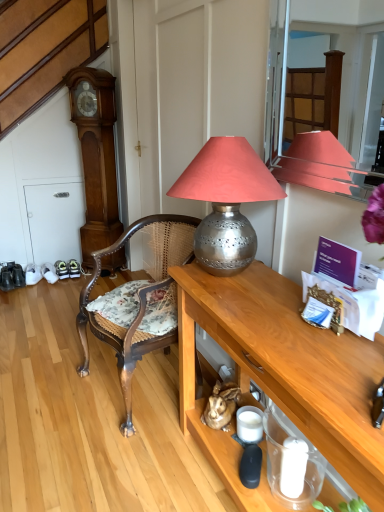
Question: Is wooden table at center closer to camera compared to wooden grandfather clock at left?

Choices:
 (A) no
 (B) yes

Answer: (B)

Question: Is wooden table at center at the right side of wooden grandfather clock at left?

Choices:
 (A) yes
 (B) no

Answer: (A)

Question: Is wooden table at center shorter than wooden grandfather clock at left?

Choices:
 (A) yes
 (B) no

Answer: (A)

Question: Is wooden table at center smaller than wooden grandfather clock at left?

Choices:
 (A) no
 (B) yes

Answer: (A)

Question: Considering the relative sizes of wooden table at center and wooden grandfather clock at left in the image provided, is wooden table at center wider than wooden grandfather clock at left?

Choices:
 (A) yes
 (B) no

Answer: (A)

Question: Looking at the image, does wooden grandfather clock at left seem bigger or smaller compared to silver metallic lampshade at center?

Choices:
 (A) big
 (B) small

Answer: (A)

Question: Does point [x=104, y=189] appear closer or farther from the camera than point [x=208, y=200]?

Choices:
 (A) closer
 (B) farther

Answer: (B)

Question: Considering the relative positions of wooden grandfather clock at left and silver metallic lampshade at center in the image provided, is wooden grandfather clock at left to the left or to the right of silver metallic lampshade at center?

Choices:
 (A) right
 (B) left

Answer: (B)

Question: Considering the positions of wooden grandfather clock at left and silver metallic lampshade at center in the image, is wooden grandfather clock at left taller or shorter than silver metallic lampshade at center?

Choices:
 (A) short
 (B) tall

Answer: (B)

Question: Considering their positions, is woven cane chair at center located in front of or behind wooden grandfather clock at left?

Choices:
 (A) behind
 (B) front

Answer: (B)

Question: Looking at the image, does woven cane chair at center seem bigger or smaller compared to wooden grandfather clock at left?

Choices:
 (A) small
 (B) big

Answer: (B)

Question: Considering the positions of woven cane chair at center and wooden grandfather clock at left in the image, is woven cane chair at center wider or thinner than wooden grandfather clock at left?

Choices:
 (A) wide
 (B) thin

Answer: (A)

Question: From a real-world perspective, is woven cane chair at center positioned above or below wooden grandfather clock at left?

Choices:
 (A) above
 (B) below

Answer: (B)

Question: In terms of width, does wooden grandfather clock at left look wider or thinner when compared to woven cane chair at center?

Choices:
 (A) thin
 (B) wide

Answer: (A)

Question: From the image's perspective, is wooden grandfather clock at left above or below woven cane chair at center?

Choices:
 (A) above
 (B) below

Answer: (A)